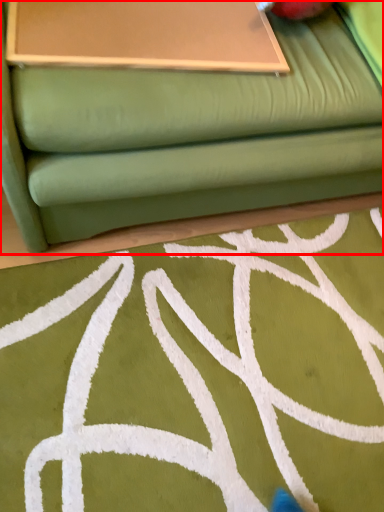
Question: Considering the relative positions of studio couch (annotated by the red box) and table in the image provided, where is studio couch (annotated by the red box) located with respect to the staircase?

Choices:
 (A) left
 (B) right

Answer: (B)